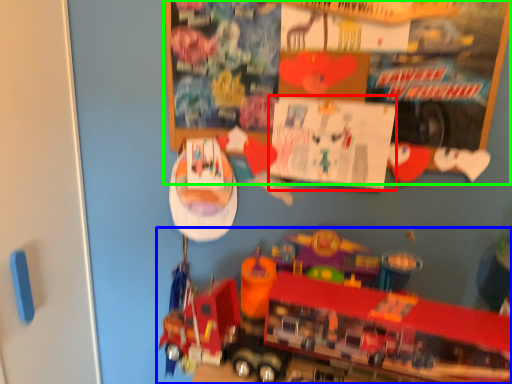
Question: Which object is positioned closest to poster page (highlighted by a red box)? Select from toy (highlighted by a blue box) and bulletin board (highlighted by a green box).

Choices:
 (A) toy
 (B) bulletin board

Answer: (B)